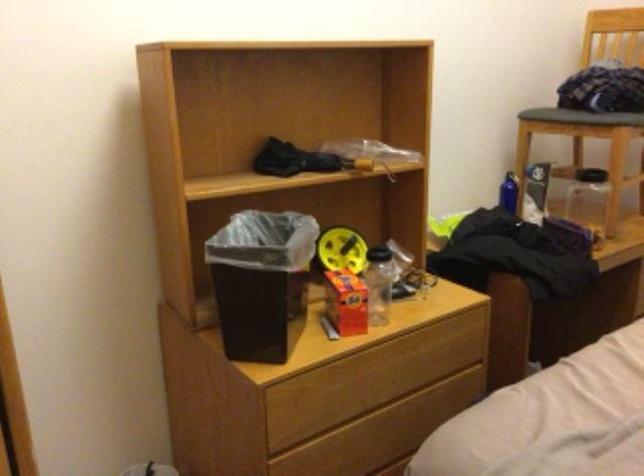
Find where to lift the blue water bottle. Please return your answer as a coordinate pair (x, y).

(507, 192)